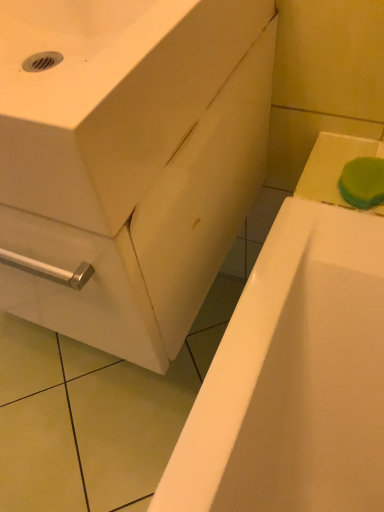
Question: Does white glossy sink at center have a smaller size compared to green sponge at upper right?

Choices:
 (A) no
 (B) yes

Answer: (A)

Question: Are white glossy sink at center and green sponge at upper right making contact?

Choices:
 (A) yes
 (B) no

Answer: (B)

Question: Considering the relative sizes of white glossy sink at center and green sponge at upper right in the image provided, is white glossy sink at center bigger than green sponge at upper right?

Choices:
 (A) no
 (B) yes

Answer: (B)

Question: From a real-world perspective, is white glossy sink at center below green sponge at upper right?

Choices:
 (A) no
 (B) yes

Answer: (A)

Question: From the image's perspective, is white glossy sink at center under green sponge at upper right?

Choices:
 (A) no
 (B) yes

Answer: (A)

Question: Is point (360, 179) closer or farther from the camera than point (360, 222)?

Choices:
 (A) farther
 (B) closer

Answer: (A)

Question: Is green sponge at upper right situated inside white glossy bathtub at lower right or outside?

Choices:
 (A) outside
 (B) inside

Answer: (A)

Question: Relative to white glossy bathtub at lower right, is green sponge at upper right in front or behind?

Choices:
 (A) front
 (B) behind

Answer: (A)

Question: From the image's perspective, relative to white glossy bathtub at lower right, is green sponge at upper right above or below?

Choices:
 (A) below
 (B) above

Answer: (B)

Question: Relative to green sponge at upper right, is white glossy bathtub at lower right in front or behind?

Choices:
 (A) behind
 (B) front

Answer: (A)

Question: Considering the relative positions of white glossy bathtub at lower right and green sponge at upper right in the image provided, is white glossy bathtub at lower right to the left or to the right of green sponge at upper right?

Choices:
 (A) right
 (B) left

Answer: (B)

Question: Looking at the image, does white glossy bathtub at lower right seem bigger or smaller compared to green sponge at upper right?

Choices:
 (A) small
 (B) big

Answer: (B)

Question: From the image's perspective, is white glossy bathtub at lower right positioned above or below green sponge at upper right?

Choices:
 (A) above
 (B) below

Answer: (B)

Question: Visually, is green sponge at upper right positioned to the left or to the right of white glossy sink at center?

Choices:
 (A) right
 (B) left

Answer: (A)

Question: In terms of width, does green sponge at upper right look wider or thinner when compared to white glossy sink at center?

Choices:
 (A) wide
 (B) thin

Answer: (B)